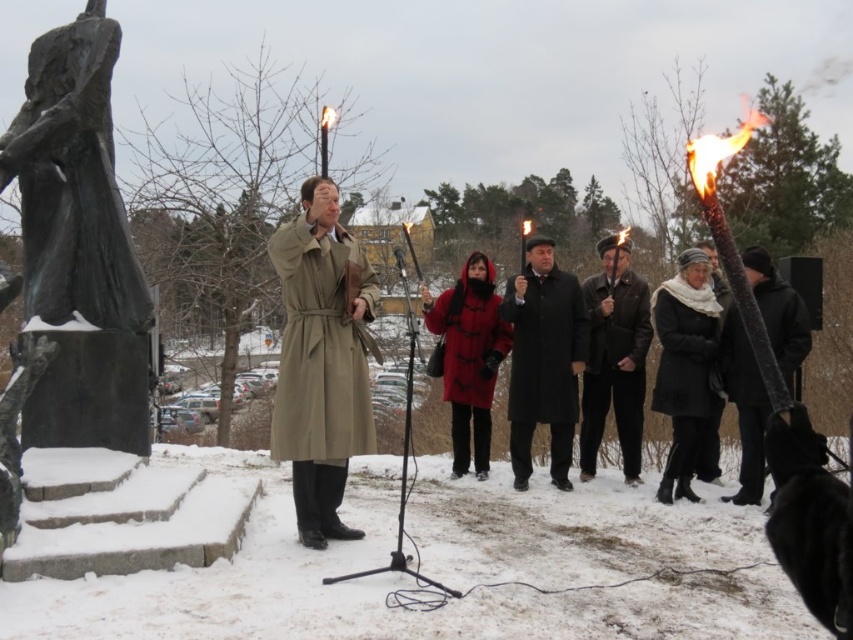
Question: Estimate the real-world distances between objects in this image. Which object is closer to the tan leather trench coat at center?

Choices:
 (A) leather jacket at center
 (B) red woolen coat at center
 (C) black woolen scarf at lower right
 (D) black matte coat at right

Answer: (B)

Question: Is leather jacket at center thinner than black matte coat at right?

Choices:
 (A) no
 (B) yes

Answer: (A)

Question: Which point appears farthest from the camera in this image?

Choices:
 (A) (659, 314)
 (B) (519, 324)
 (C) (602, 262)

Answer: (C)

Question: Does bronze statue at left have a lesser width compared to leather jacket at center?

Choices:
 (A) yes
 (B) no

Answer: (B)

Question: Which of the following is the farthest from the observer?

Choices:
 (A) red woolen coat at center
 (B) black matte coat at center
 (C) leather jacket at center
 (D) bronze statue at left

Answer: (A)

Question: Is black matte coat at center wider than red woolen coat at center?

Choices:
 (A) no
 (B) yes

Answer: (A)